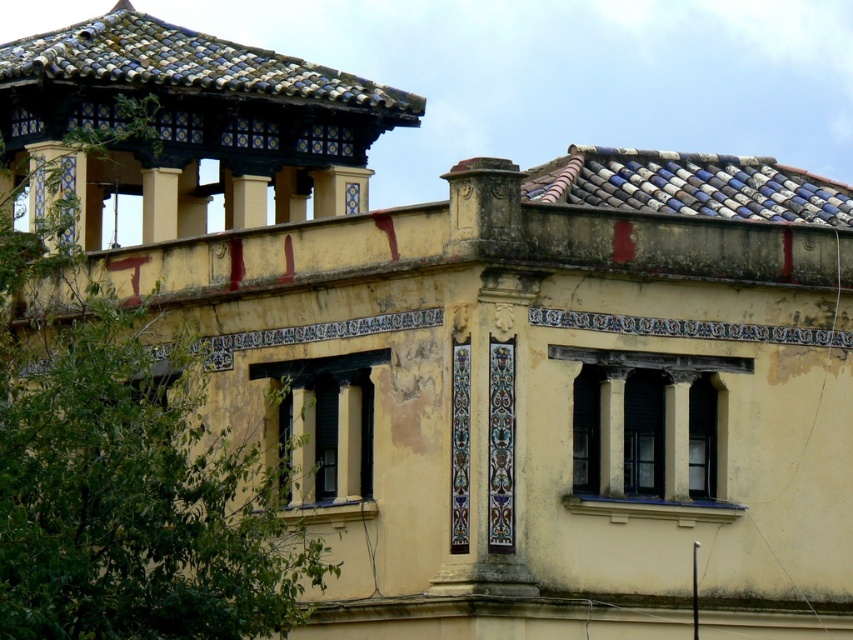
Is blue and white tiled roof at upper left wider than blue and white glazed tiles at upper right?

Yes, blue and white tiled roof at upper left is wider than blue and white glazed tiles at upper right.

Is blue and white tiled roof at upper left taller than blue and white glazed tiles at upper right?

Indeed, blue and white tiled roof at upper left has a greater height compared to blue and white glazed tiles at upper right.

Locate an element on the screen. The image size is (853, 640). blue and white tiled roof at upper left is located at coordinates (189, 65).